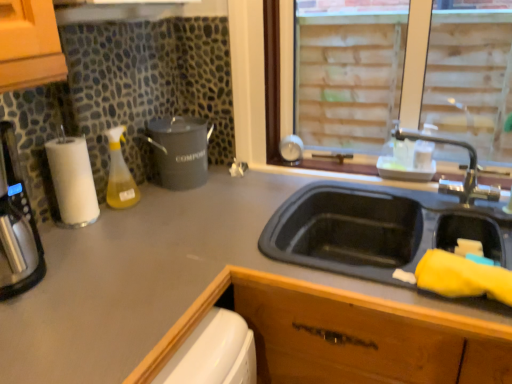
Question: Is matte gray countertop at center positioned beyond the bounds of translucent yellow liquid at bottle left?

Choices:
 (A) no
 (B) yes

Answer: (B)

Question: Is matte gray countertop at center facing towards translucent yellow liquid at bottle left?

Choices:
 (A) yes
 (B) no

Answer: (B)

Question: From a real-world perspective, is matte gray countertop at center physically below translucent yellow liquid at bottle left?

Choices:
 (A) yes
 (B) no

Answer: (A)

Question: Is matte gray countertop at center closer to the viewer compared to translucent yellow liquid at bottle left?

Choices:
 (A) yes
 (B) no

Answer: (A)

Question: Can you confirm if matte gray countertop at center is thinner than translucent yellow liquid at bottle left?

Choices:
 (A) no
 (B) yes

Answer: (A)

Question: Considering the relative sizes of matte gray countertop at center and translucent yellow liquid at bottle left in the image provided, is matte gray countertop at center shorter than translucent yellow liquid at bottle left?

Choices:
 (A) no
 (B) yes

Answer: (A)

Question: From the image's perspective, is matte gray countertop at center on matte black compost bin at center-left?

Choices:
 (A) no
 (B) yes

Answer: (A)

Question: Considering the relative positions of matte gray countertop at center and matte black compost bin at center-left in the image provided, is matte gray countertop at center to the right of matte black compost bin at center-left from the viewer's perspective?

Choices:
 (A) no
 (B) yes

Answer: (B)

Question: Is matte gray countertop at center far from matte black compost bin at center-left?

Choices:
 (A) yes
 (B) no

Answer: (B)

Question: Is matte gray countertop at center not inside matte black compost bin at center-left?

Choices:
 (A) yes
 (B) no

Answer: (A)

Question: From a real-world perspective, is matte gray countertop at center physically above matte black compost bin at center-left?

Choices:
 (A) yes
 (B) no

Answer: (B)

Question: Is matte black compost bin at center-left inside matte gray countertop at center?

Choices:
 (A) yes
 (B) no

Answer: (B)

Question: Is brass metallic faucet at upper right smaller than matte gray countertop at center?

Choices:
 (A) yes
 (B) no

Answer: (A)